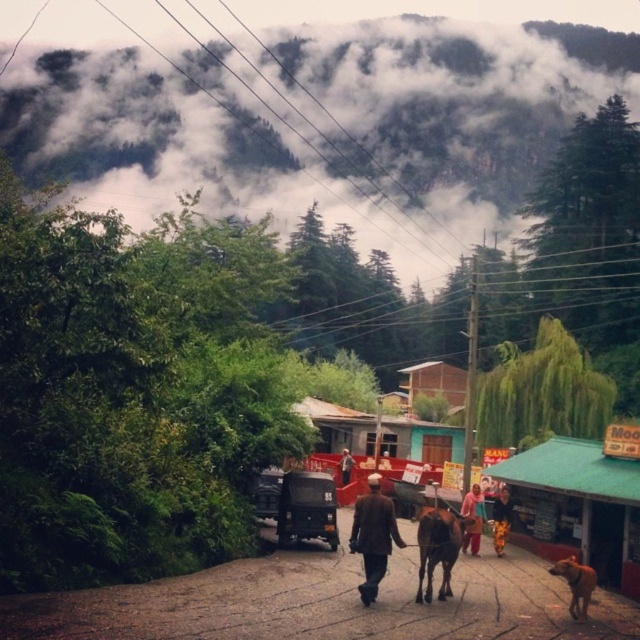
You are a GUI agent. You are given a task and a screenshot of the screen. Output one action in this format:
    pyautogui.click(x=<x>, y=<y>)
    Task: Click on the foggy misty mountain at upper center
    The width and height of the screenshot is (640, 640).
    Given the screenshot: What is the action you would take?
    310,116

Does foggy misty mountain at upper center appear on the right side of multicolored fabric at center?

No, foggy misty mountain at upper center is not to the right of multicolored fabric at center.

Locate an element on the screen. The height and width of the screenshot is (640, 640). foggy misty mountain at upper center is located at coordinates (310, 116).

Can you confirm if dark brown woolen coat at center is thinner than metallic gray truck at center?

No, dark brown woolen coat at center is not thinner than metallic gray truck at center.

The image size is (640, 640). Describe the element at coordinates (372, 536) in the screenshot. I see `dark brown woolen coat at center` at that location.

Is point (378, 545) in front of point (276, 502)?

Yes, it is in front of point (276, 502).

At what (x,y) coordinates should I click in order to perform the action: click on dark brown woolen coat at center. Please return your answer as a coordinate pair (x, y). Looking at the image, I should click on (372, 536).

Between multicolored fabric at center and yellow fabric pants at lower right, which one appears on the right side from the viewer's perspective?

yellow fabric pants at lower right

Can you confirm if multicolored fabric at center is positioned above yellow fabric pants at lower right?

Yes, multicolored fabric at center is above yellow fabric pants at lower right.

Between point (492, 515) and point (506, 529), which one is positioned behind?

The point (492, 515) is more distant.

Find the location of a particular element. multicolored fabric at center is located at coordinates (472, 518).